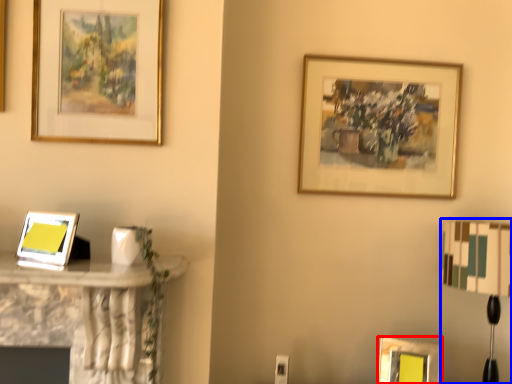
Question: Among these objects, which one is nearest to the camera, picture frame (highlighted by a red box) or table lamp (highlighted by a blue box)?

Choices:
 (A) picture frame
 (B) table lamp

Answer: (B)